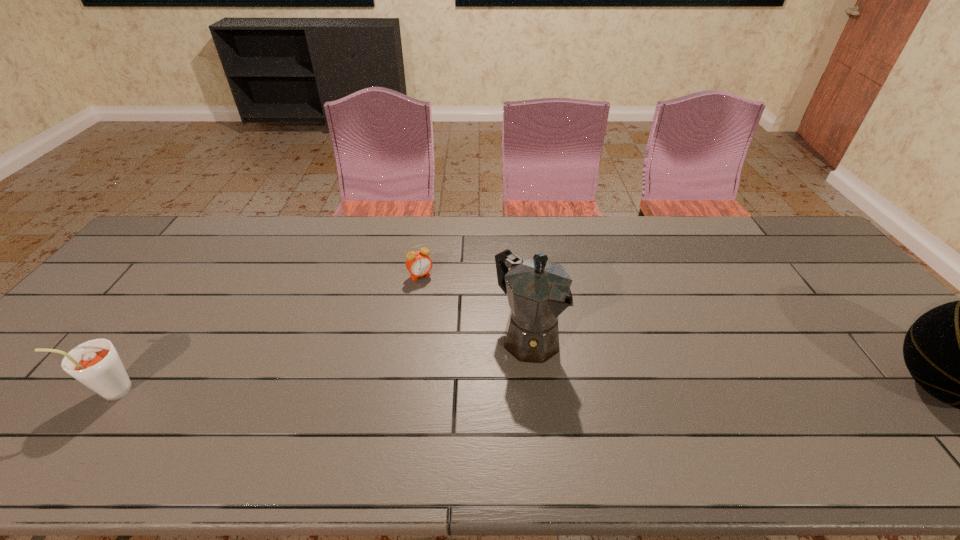
You are a GUI agent. You are given a task and a screenshot of the screen. Output one action in this format:
    pyautogui.click(x=<x>, y=<y>)
    Task: Click on the vacant region at the near left corner of the desktop
    This screenshot has height=540, width=960.
    Given the screenshot: What is the action you would take?
    pyautogui.click(x=27, y=414)

At what (x,y) coordinates should I click in order to perform the action: click on free location at the near right corner. Please return your answer as a coordinate pair (x, y). The width and height of the screenshot is (960, 540). Looking at the image, I should click on (912, 403).

Locate an element on the screen. This screenshot has width=960, height=540. empty location between the shortest object and the leftmost object is located at coordinates (266, 333).

I want to click on empty location between the alarm clock and the third object from left to right, so click(473, 306).

Where is `free space between the coffeepot and the alarm clock`? free space between the coffeepot and the alarm clock is located at coordinates tap(473, 306).

You are a GUI agent. You are given a task and a screenshot of the screen. Output one action in this format:
    pyautogui.click(x=<x>, y=<y>)
    Task: Click on the free space between the second object from right to left and the third tallest object
    
    Given the screenshot: What is the action you would take?
    pyautogui.click(x=320, y=363)

Find the location of a particular element. vacant point located between the alarm clock and the second shortest object is located at coordinates (266, 333).

Image resolution: width=960 pixels, height=540 pixels. In order to click on free space between the second object from right to left and the second object from left to right in this screenshot , I will do `click(473, 306)`.

Point out which object is positioned as the second nearest to the coffeepot. Please provide its 2D coordinates. Your answer should be formatted as a tuple, i.e. [(x, y)], where the tuple contains the x and y coordinates of a point satisfying the conditions above.

[(959, 352)]

Locate which object ranks in proximity to the leftmost object. Please provide its 2D coordinates. Your answer should be formatted as a tuple, i.e. [(x, y)], where the tuple contains the x and y coordinates of a point satisfying the conditions above.

[(419, 264)]